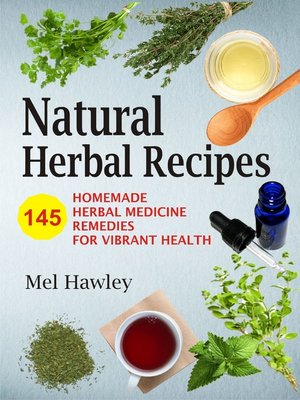
Where is `bowl`? The image size is (300, 400). bowl is located at coordinates (216, 80).